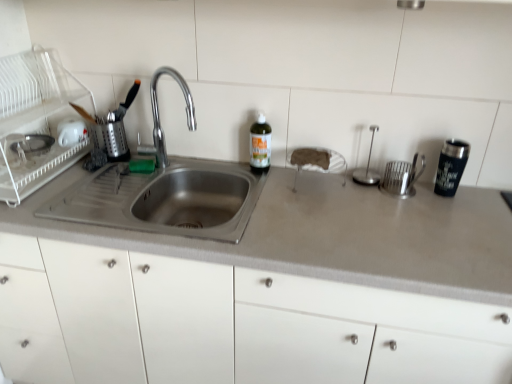
Find the location of a particular element. The height and width of the screenshot is (384, 512). vacant area that lies between polished stainless steel spoon holder at right, which is counted as the 4th appliance, starting from the left, and white matte sponge at center, which is counted as the third appliance, starting from the left is located at coordinates (350, 187).